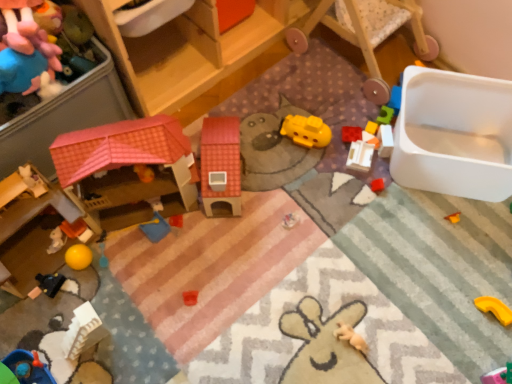
Where is `vacant space in between white plastic blocks at right, placed as the tenth toy when sorted from left to right, and matte plastic dollhouse at center-left, the fourth toy viewed from the left`? vacant space in between white plastic blocks at right, placed as the tenth toy when sorted from left to right, and matte plastic dollhouse at center-left, the fourth toy viewed from the left is located at coordinates (293, 173).